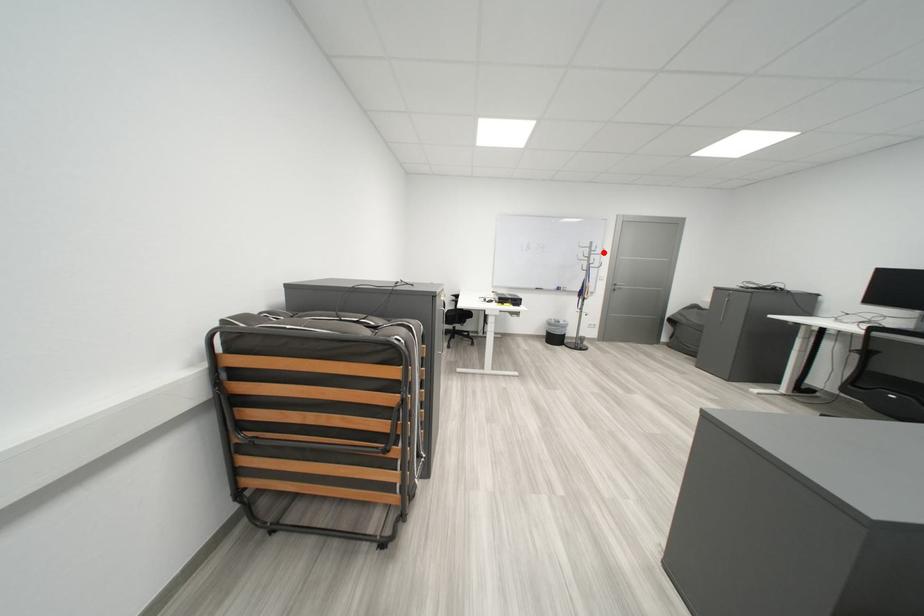
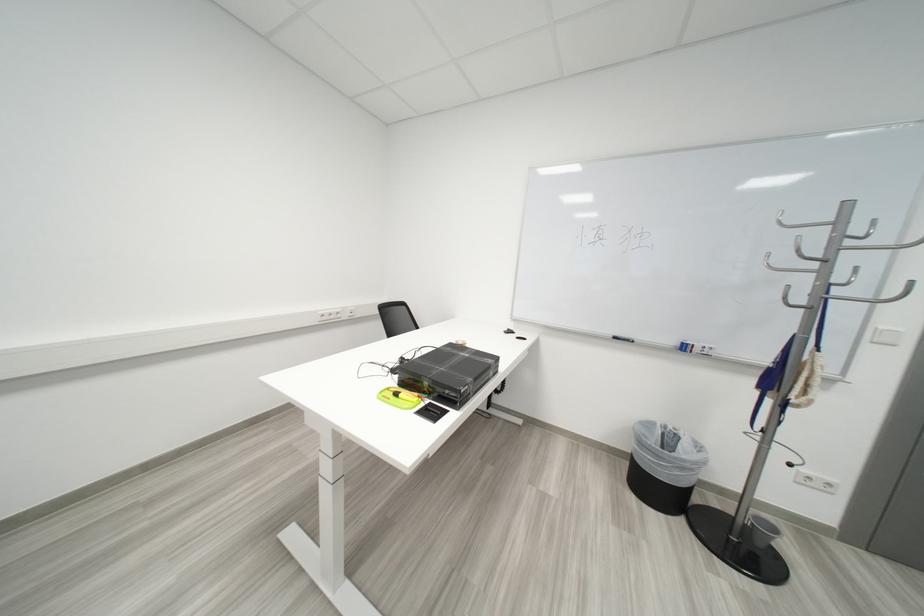
Where in the second image is the point corresponding to the highlighted location from the first image?

(853, 238)